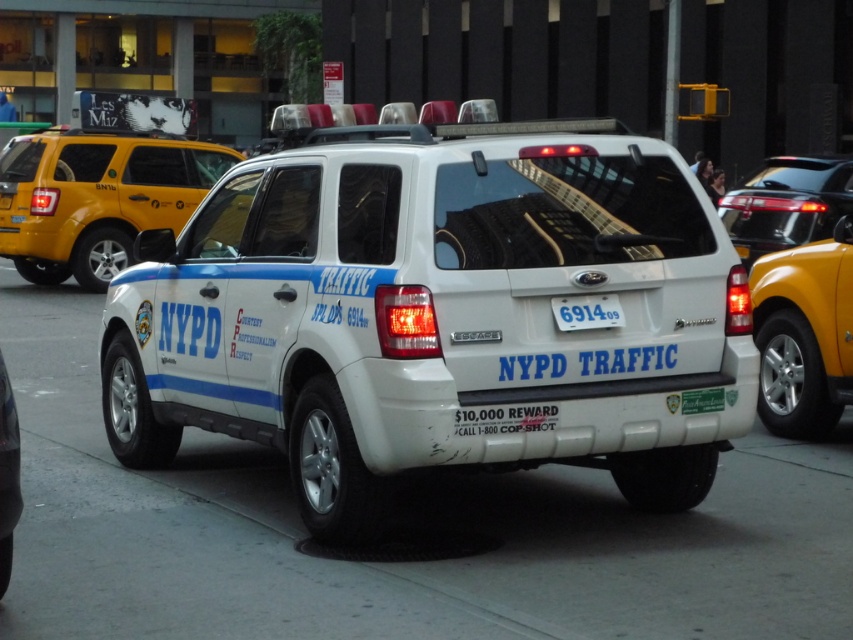
Question: Is white asphalt pavement at center thinner than yellow matte taxi at center?

Choices:
 (A) no
 (B) yes

Answer: (A)

Question: Can you confirm if shiny black sedan at right is positioned above white plastic license plate at center?

Choices:
 (A) no
 (B) yes

Answer: (B)

Question: Which object appears closest to the camera in this image?

Choices:
 (A) yellow matte taxi at center
 (B) white glossy suv at center
 (C) shiny black sedan at right

Answer: (B)

Question: Does yellow matte taxi at center appear on the right side of shiny black sedan at right?

Choices:
 (A) yes
 (B) no

Answer: (B)

Question: Which object is farther from the camera taking this photo?

Choices:
 (A) metallic yellow taxi at right
 (B) white glossy suv at center
 (C) white plastic license plate at center
 (D) yellow matte taxi at center

Answer: (D)

Question: Which object appears farthest from the camera in this image?

Choices:
 (A) yellow matte taxi at center
 (B) white plastic license plate at center
 (C) white glossy suv at center

Answer: (A)